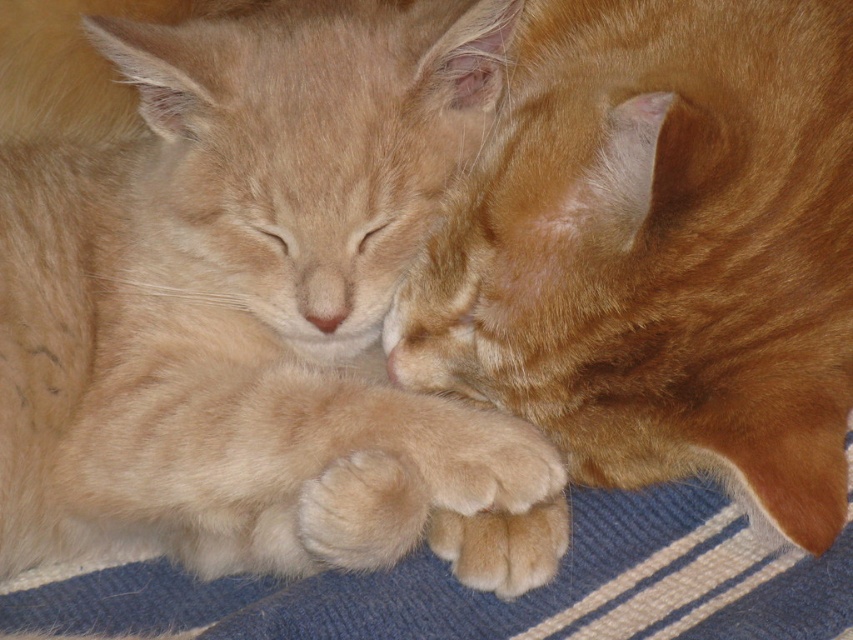
Question: Which of the following is the closest to the observer?

Choices:
 (A) (680, 225)
 (B) (534, 525)
 (C) (358, 492)
 (D) (202, 371)

Answer: (A)

Question: Which object appears closest to the camera in this image?

Choices:
 (A) soft orange fur at center
 (B) soft fur paw at lower center
 (C) orange fur cat at center

Answer: (C)

Question: Which object is positioned farthest from the orange fur cat at center?

Choices:
 (A) soft orange fur paw at center
 (B) soft fur paw at lower center
 (C) soft orange fur at center

Answer: (A)

Question: Is soft orange fur paw at center bigger than soft fur paw at lower center?

Choices:
 (A) yes
 (B) no

Answer: (A)

Question: Is orange fur cat at center wider than fuzzy orange paw at lower center?

Choices:
 (A) no
 (B) yes

Answer: (B)

Question: Is soft orange fur at center wider than soft fur paw at lower center?

Choices:
 (A) no
 (B) yes

Answer: (B)